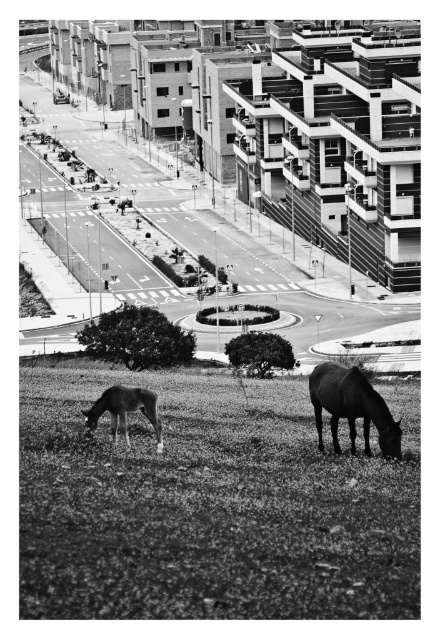
Who is lower down, grassy field at lower center or dark brown horse at lower right?

grassy field at lower center

Who is positioned more to the right, grassy field at lower center or dark brown horse at lower right?

From the viewer's perspective, dark brown horse at lower right appears more on the right side.

What are the coordinates of `grassy field at lower center` in the screenshot? It's located at (209, 506).

I want to click on grassy field at lower center, so click(209, 506).

Can you confirm if dark brown horse at lower right is shorter than smooth brown horse at lower left?

In fact, dark brown horse at lower right may be taller than smooth brown horse at lower left.

I want to click on dark brown horse at lower right, so click(x=352, y=406).

Measure the distance between grassy field at lower center and camera.

grassy field at lower center and camera are 85.23 feet apart from each other.

Does point (285, 416) come in front of point (92, 419)?

No, (285, 416) is further to viewer.

Locate an element on the screen. This screenshot has height=640, width=440. grassy field at lower center is located at coordinates (209, 506).